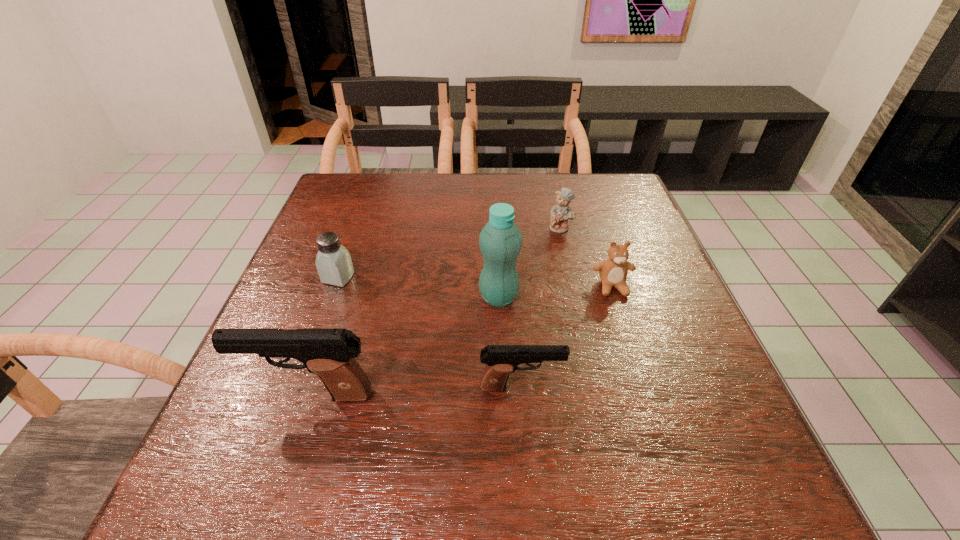
Find the location of `free spot between the taller pistol and the right pistol`. free spot between the taller pistol and the right pistol is located at coordinates (416, 391).

Where is `free spot between the saltshaker and the second object from right to left`? free spot between the saltshaker and the second object from right to left is located at coordinates click(x=449, y=253).

Locate an element on the screen. empty space that is in between the shorter pistol and the taller pistol is located at coordinates (416, 391).

The width and height of the screenshot is (960, 540). Find the location of `object that is the closest one to the right pistol`. object that is the closest one to the right pistol is located at coordinates click(500, 241).

I want to click on object that ranks as the closest to the rightmost object, so click(x=560, y=213).

Locate an element on the screen. free location that satisfies the following two spatial constraints: 1. at the front cap of the water bottle; 2. at the barrel of the taller pistol is located at coordinates (503, 395).

The width and height of the screenshot is (960, 540). What are the coordinates of `free location that satisfies the following two spatial constraints: 1. on the front-facing side of the nearer teddy bear; 2. at the barrel of the second tallest object` in the screenshot? It's located at (647, 395).

Identify the location of vacant point that satisfies the following two spatial constraints: 1. on the front-facing side of the farthest object; 2. at the barrel of the second tallest object. The height and width of the screenshot is (540, 960). (599, 395).

Where is `vacant area that satisfies the following two spatial constraints: 1. at the front cap of the water bottle; 2. at the barrel of the taller pistol`? vacant area that satisfies the following two spatial constraints: 1. at the front cap of the water bottle; 2. at the barrel of the taller pistol is located at coordinates (503, 395).

Where is `free space that satisfies the following two spatial constraints: 1. on the front-facing side of the nearer teddy bear; 2. at the barrel of the shorter pistol`? free space that satisfies the following two spatial constraints: 1. on the front-facing side of the nearer teddy bear; 2. at the barrel of the shorter pistol is located at coordinates (645, 387).